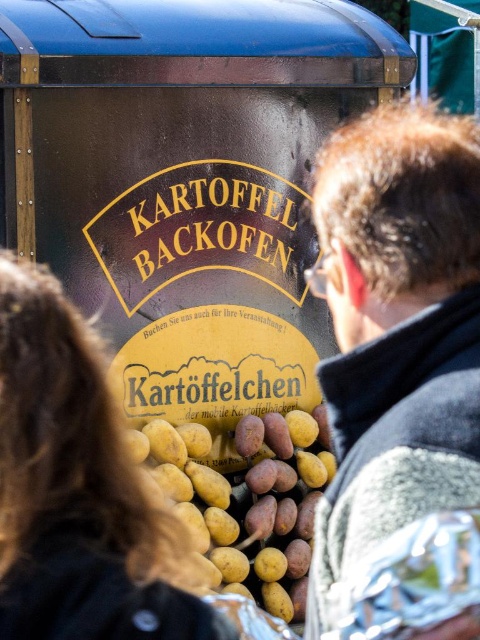
Question: Which point is closer to the camera?

Choices:
 (A) yellow matte potatoes at center
 (B) gray woolen jacket at center

Answer: (B)

Question: Can you confirm if gray woolen jacket at center is positioned to the left of blonde hair at center?

Choices:
 (A) no
 (B) yes

Answer: (A)

Question: In this image, where is blonde hair at center located relative to yellow matte potatoes at center?

Choices:
 (A) right
 (B) left

Answer: (B)

Question: Can you confirm if gray woolen jacket at center is wider than blonde hair at center?

Choices:
 (A) yes
 (B) no

Answer: (A)

Question: Among these objects, which one is nearest to the camera?

Choices:
 (A) gray woolen jacket at center
 (B) yellow matte potatoes at center

Answer: (A)

Question: Based on their relative distances, which object is nearer to the blonde hair at center?

Choices:
 (A) yellow matte potatoes at center
 (B) gray woolen jacket at center

Answer: (B)